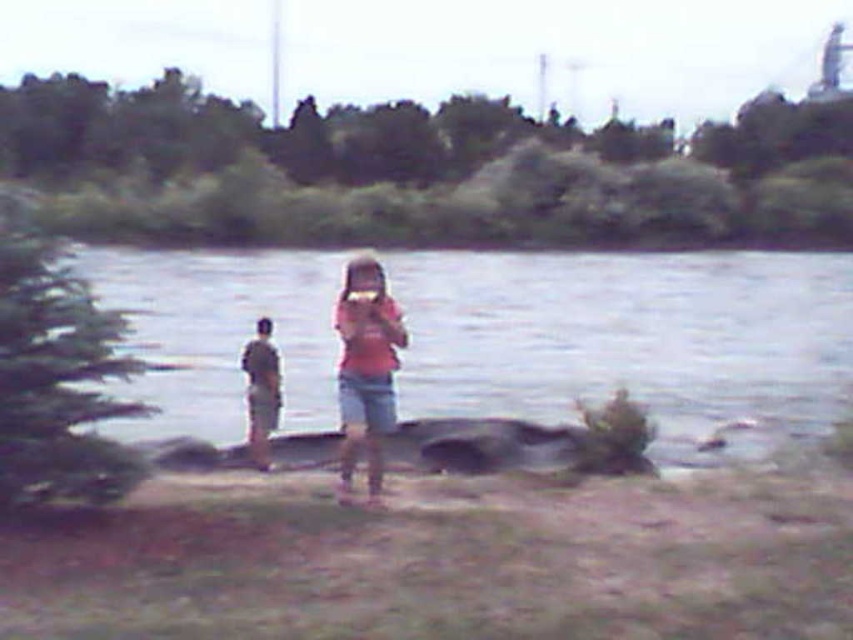
Question: Is pink matte shirt at center in front of light brown wooden stick at left?

Choices:
 (A) no
 (B) yes

Answer: (B)

Question: Among these objects, which one is nearest to the camera?

Choices:
 (A) gray smooth rock at center
 (B) light brown wooden stick at left

Answer: (A)

Question: Which object is farther from the camera taking this photo?

Choices:
 (A) light brown wooden stick at left
 (B) pink matte shirt at center

Answer: (A)

Question: Estimate the real-world distances between objects in this image. Which object is farther from the light brown wooden stick at left?

Choices:
 (A) gray smooth rock at center
 (B) pink matte shirt at center

Answer: (A)

Question: Can you confirm if gray smooth rock at center is wider than pink matte shirt at center?

Choices:
 (A) yes
 (B) no

Answer: (A)

Question: From the image, what is the correct spatial relationship of gray smooth rock at center in relation to pink matte shirt at center?

Choices:
 (A) right
 (B) left

Answer: (B)